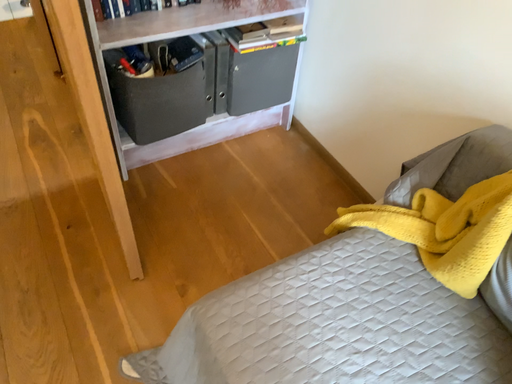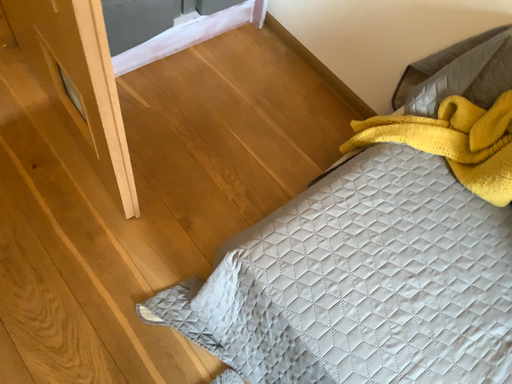
Question: How did the camera likely rotate when shooting the video?

Choices:
 (A) rotated left
 (B) rotated right

Answer: (B)